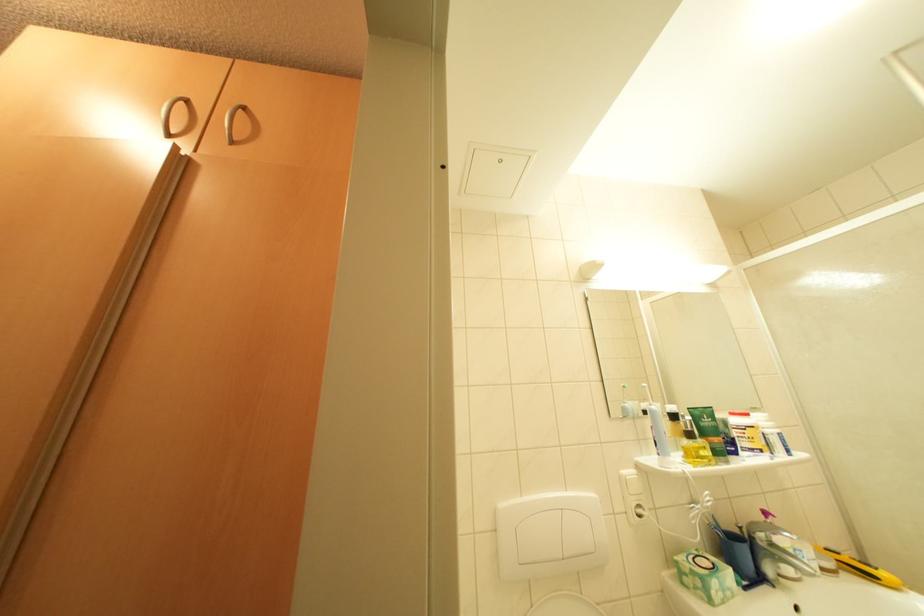
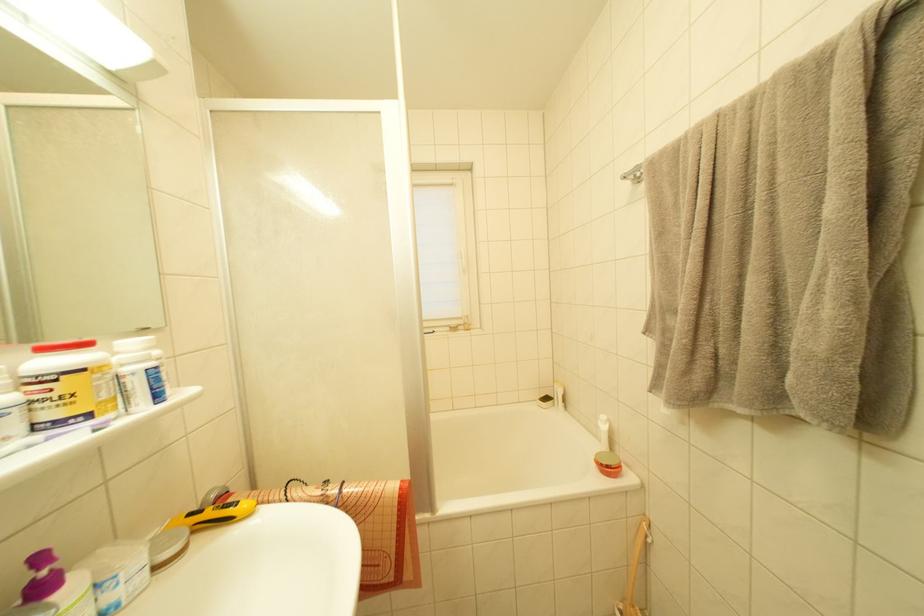
Where in the second image is the point corresponding to pixel 889 580 from the first image?

(248, 511)